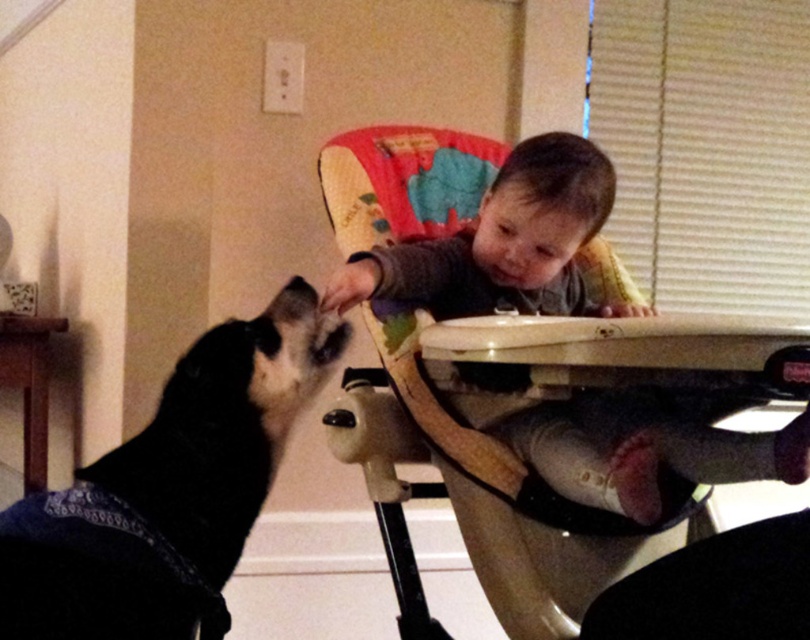
Question: Is beige plastic high chair at center thinner than black fabric dog at left?

Choices:
 (A) yes
 (B) no

Answer: (B)

Question: Which point appears farthest from the camera in this image?

Choices:
 (A) (310, 342)
 (B) (482, 224)

Answer: (B)

Question: In this image, where is beige plastic high chair at center located relative to black fabric dog at left?

Choices:
 (A) below
 (B) above

Answer: (B)

Question: Is beige plastic high chair at center to the left of black fabric dog at left from the viewer's perspective?

Choices:
 (A) yes
 (B) no

Answer: (B)